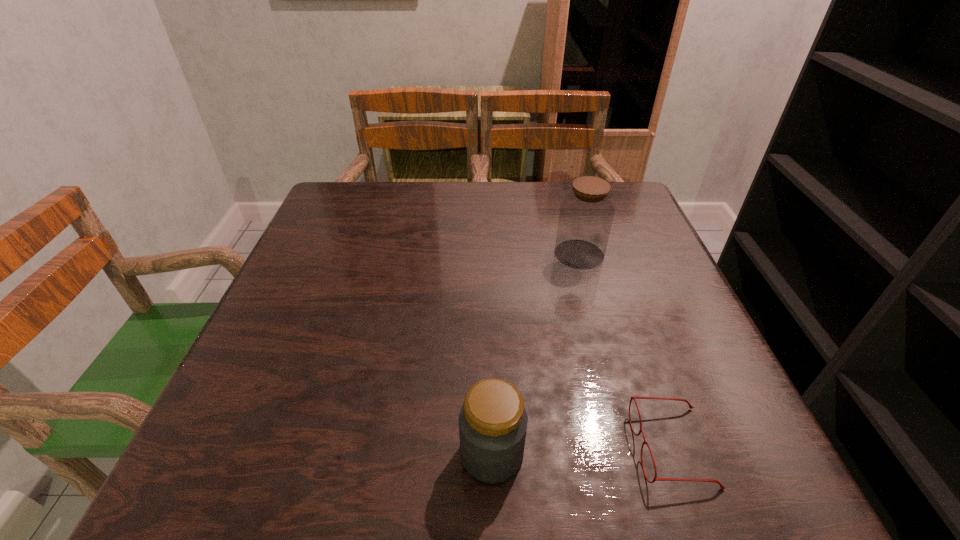
The image size is (960, 540). What are the coordinates of `the farther jar` in the screenshot? It's located at (586, 214).

The image size is (960, 540). What are the coordinates of `the right jar` in the screenshot? It's located at (586, 214).

Locate an element on the screen. This screenshot has width=960, height=540. the second shortest object is located at coordinates (493, 421).

Locate an element on the screen. This screenshot has width=960, height=540. the leftmost object is located at coordinates (493, 421).

Locate an element on the screen. the shortest object is located at coordinates (632, 397).

Where is `vacant space located 0.350m on the front of the farther jar`? vacant space located 0.350m on the front of the farther jar is located at coordinates (622, 409).

Find the location of a particular element. This screenshot has height=540, width=960. blank area located on the surface of the left jar near the warning symbol is located at coordinates (352, 454).

At what (x,y) coordinates should I click in order to perform the action: click on vacant space located 0.230m on the surface of the left jar near the warning symbol. Please return your answer as a coordinate pair (x, y). Image resolution: width=960 pixels, height=540 pixels. Looking at the image, I should click on (305, 454).

This screenshot has width=960, height=540. I want to click on free region located on the surface of the left jar near the warning symbol, so click(x=305, y=454).

Find the location of a particular element. Image resolution: width=960 pixels, height=540 pixels. vacant space located on the face of the spectacles is located at coordinates (422, 447).